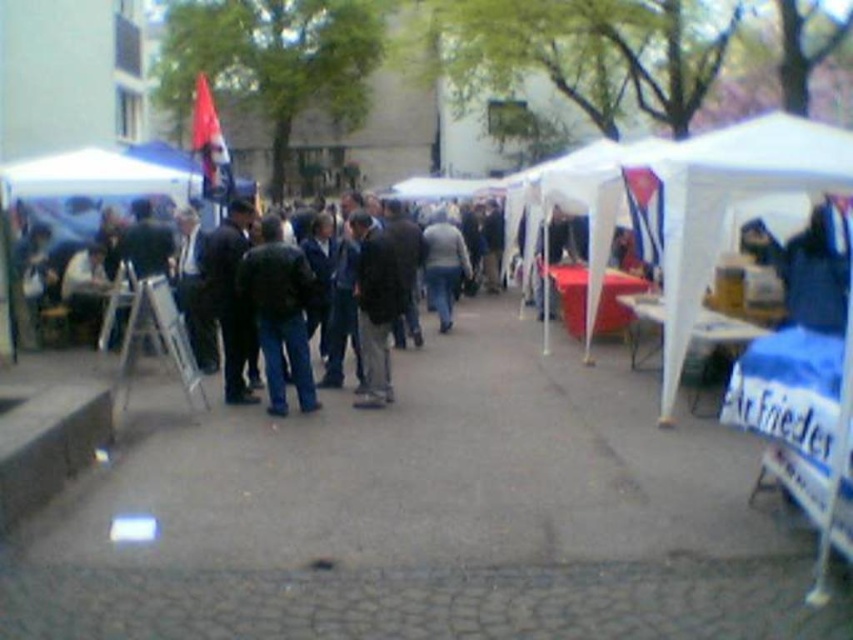
Question: Which object is closer to the camera taking this photo?

Choices:
 (A) gray sweater at center
 (B) white fabric canopy at right
 (C) dark blue jacket at center

Answer: (B)

Question: Which point appears closest to the camera in this image?

Choices:
 (A) [x=296, y=260]
 (B) [x=450, y=285]
 (C) [x=811, y=150]

Answer: (C)

Question: Is white fabric canopy at right thinner than dark blue leather jacket at center?

Choices:
 (A) yes
 (B) no

Answer: (A)

Question: Is white fabric canopy at right below gray sweater at center?

Choices:
 (A) yes
 (B) no

Answer: (B)

Question: Which of the following is the closest to the observer?

Choices:
 (A) gray sweater at center
 (B) white fabric canopy at right

Answer: (B)

Question: In this image, where is dark blue leather jacket at center located relative to gray sweater at center?

Choices:
 (A) below
 (B) above

Answer: (A)